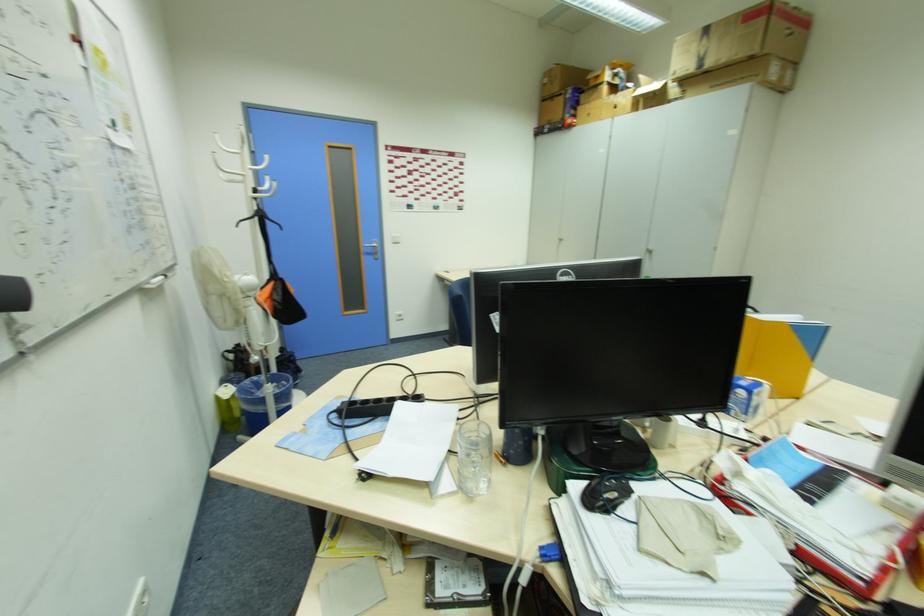
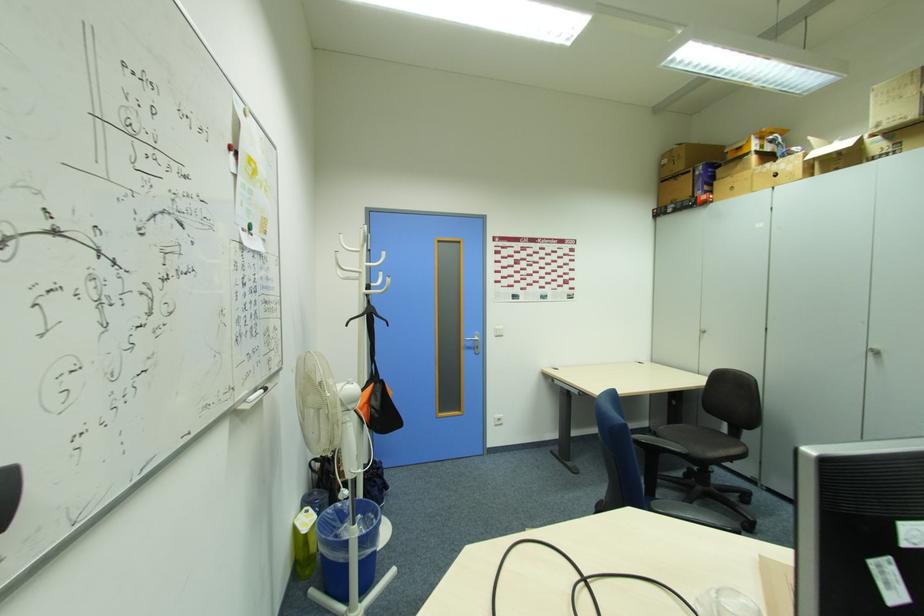
The point at (549,100) is marked in the first image. Where is the corresponding point in the second image?

(665, 182)